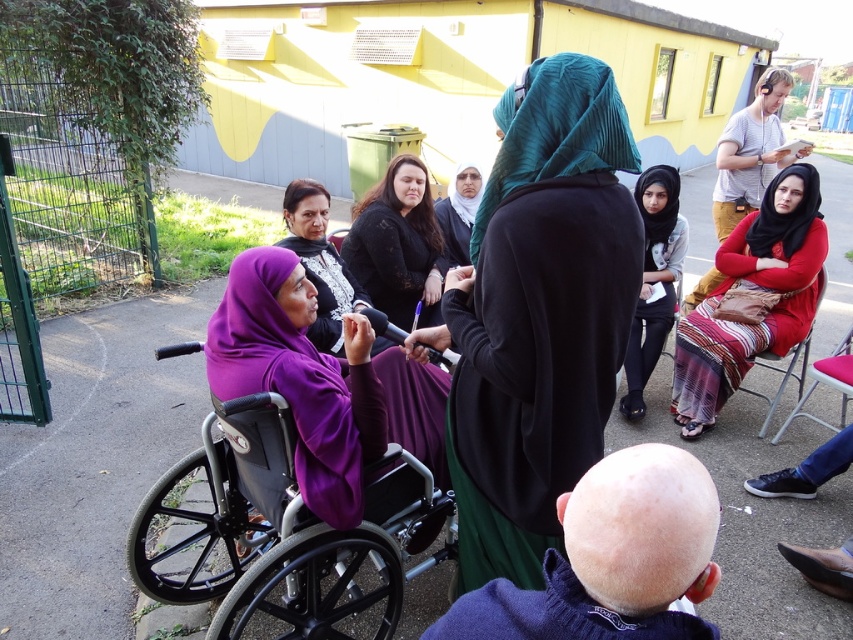
Question: Which of the following is the closest to the observer?

Choices:
 (A) (675, 177)
 (B) (788, 362)
 (C) (346, 371)

Answer: (C)

Question: Where is purple knitted robe at lower center located in relation to black jersey at center in the image?

Choices:
 (A) left
 (B) right

Answer: (A)

Question: Among these objects, which one is nearest to the camera?

Choices:
 (A) bald head at center
 (B) black lace dress at center

Answer: (A)

Question: Is purple fabric wheelchair at lower left positioned behind black jersey at center?

Choices:
 (A) yes
 (B) no

Answer: (B)

Question: Which point is farther to the camera?

Choices:
 (A) (405, 576)
 (B) (544, 60)
 (C) (335, 257)

Answer: (C)

Question: Does teal satin hijab at center appear under bald head at center?

Choices:
 (A) no
 (B) yes

Answer: (A)